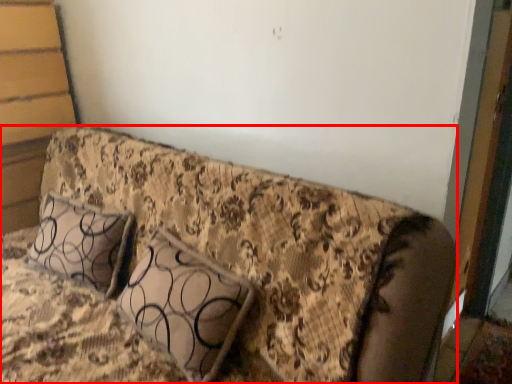
Question: Considering the relative positions of furniture (annotated by the red box) and pillow in the image provided, where is furniture (annotated by the red box) located with respect to the staircase?

Choices:
 (A) left
 (B) right

Answer: (A)